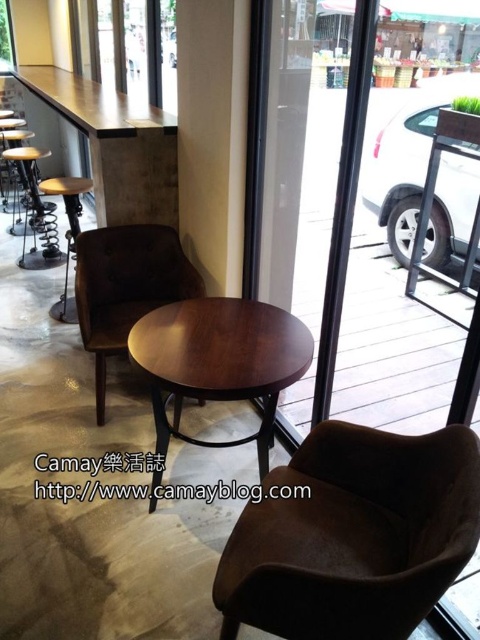
Question: Is brown suede swivel chair at lower right thinner than brown leather armchair at center?

Choices:
 (A) yes
 (B) no

Answer: (A)

Question: Is brown leather armchair at center further to camera compared to wooden seat at left?

Choices:
 (A) yes
 (B) no

Answer: (B)

Question: Which point is farther from the camera taking this photo?

Choices:
 (A) (55, 179)
 (B) (312, 296)
 (C) (83, 296)
 (D) (27, 212)

Answer: (D)

Question: Which point is closer to the camera?

Choices:
 (A) [x=240, y=380]
 (B) [x=311, y=221]

Answer: (A)

Question: Is brown suede swivel chair at lower right wider than brown leather armchair at center?

Choices:
 (A) yes
 (B) no

Answer: (B)

Question: Which point is closer to the camera?

Choices:
 (A) (48, 212)
 (B) (41, 189)
 (C) (225, 582)

Answer: (C)